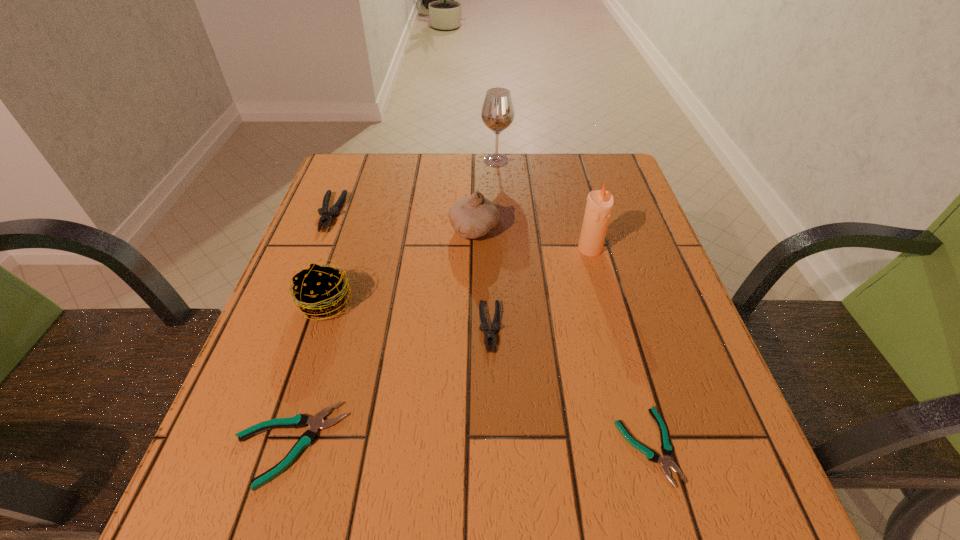
At what (x,y) coordinates should I click in order to perform the action: click on wineglass at the far edge. Please return your answer as a coordinate pair (x, y). This screenshot has width=960, height=540. Looking at the image, I should click on (497, 114).

Where is `pliers situated at the far edge`? The height and width of the screenshot is (540, 960). pliers situated at the far edge is located at coordinates (327, 216).

Where is `patty that is at the left edge`? patty that is at the left edge is located at coordinates (320, 291).

The width and height of the screenshot is (960, 540). I want to click on candle that is at the right edge, so click(599, 206).

Identify the location of pliers present at the right edge. The height and width of the screenshot is (540, 960). (665, 461).

This screenshot has height=540, width=960. What are the coordinates of `object situated at the far left corner` in the screenshot? It's located at (327, 216).

At what (x,y) coordinates should I click in order to perform the action: click on object that is at the near left corner. Please return your answer as a coordinate pair (x, y). This screenshot has height=540, width=960. Looking at the image, I should click on (315, 423).

Where is `object positioned at the near right corner`? object positioned at the near right corner is located at coordinates (665, 461).

The width and height of the screenshot is (960, 540). I want to click on vacant space at the far edge of the desktop, so (439, 156).

In the image, there is a desktop. At what (x,y) coordinates should I click in order to perform the action: click on vacant space at the near edge. Please return your answer as a coordinate pair (x, y). The image size is (960, 540). Looking at the image, I should click on (333, 488).